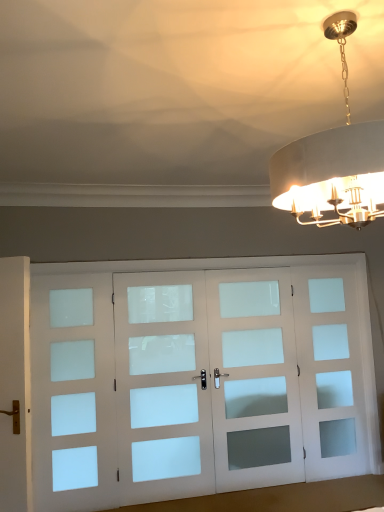
This screenshot has width=384, height=512. What do you see at coordinates (333, 161) in the screenshot? I see `metallic gold chandelier at upper right` at bounding box center [333, 161].

Image resolution: width=384 pixels, height=512 pixels. What do you see at coordinates (254, 379) in the screenshot? I see `white frosted glass screen door at center, the 3th screen door from the left` at bounding box center [254, 379].

The image size is (384, 512). What do you see at coordinates (162, 386) in the screenshot?
I see `white frosted glass door at center, acting as the second screen door starting from the left` at bounding box center [162, 386].

You are a GUI agent. You are given a task and a screenshot of the screen. Output one action in this format:
    pyautogui.click(x=<x>, y=<y>)
    Task: Click on the white frosted glass screen door at right, the 1th screen door in the right-to-left sequence
    The height and width of the screenshot is (512, 384).
    Given the screenshot: What is the action you would take?
    pyautogui.click(x=330, y=371)

From a real-world perspective, is white frosted glass door at center, which is the third screen door from right to left, above or below metallic gold chandelier at upper right?

white frosted glass door at center, which is the third screen door from right to left, is situated lower than metallic gold chandelier at upper right in the real world.

Can you tell me how much white frosted glass door at center, which is the third screen door from right to left, and metallic gold chandelier at upper right differ in facing direction?

They differ by 91.1 degrees in their facing directions.

Is there a large distance between white frosted glass door at center, acting as the second screen door starting from the left, and metallic gold chandelier at upper right?

Yes, white frosted glass door at center, acting as the second screen door starting from the left, is far from metallic gold chandelier at upper right.

From the image's perspective, which one is positioned higher, white frosted glass door at center, acting as the second screen door starting from the left, or metallic gold chandelier at upper right?

metallic gold chandelier at upper right.

Do you think metallic gold chandelier at upper right is within white frosted glass door at center, which is the third screen door from right to left, or outside of it?

metallic gold chandelier at upper right is outside white frosted glass door at center, which is the third screen door from right to left.

Looking at this image, is metallic gold chandelier at upper right bigger or smaller than white frosted glass door at center, acting as the second screen door starting from the left?

In the image, metallic gold chandelier at upper right appears to be larger than white frosted glass door at center, acting as the second screen door starting from the left.

Is metallic gold chandelier at upper right further to the viewer compared to white frosted glass door at center, which is the third screen door from right to left?

No.

How many degrees apart are the facing directions of metallic gold chandelier at upper right and white frosted glass door at center, which is the third screen door from right to left?

metallic gold chandelier at upper right and white frosted glass door at center, which is the third screen door from right to left, are facing 91.1 degrees away from each other.

From a real-world perspective, between white frosted glass screen door at right, the 1th screen door in the right-to-left sequence, and metallic gold chandelier at upper right, who is vertically higher?

In real-world perspective, metallic gold chandelier at upper right is above.

From the image's perspective, which one is positioned lower, white frosted glass screen door at right, the fourth screen door when ordered from left to right, or metallic gold chandelier at upper right?

From the image's view, white frosted glass screen door at right, the fourth screen door when ordered from left to right, is below.

In the scene shown: Considering the relative positions of white frosted glass screen door at right, the fourth screen door when ordered from left to right, and metallic gold chandelier at upper right in the image provided, is white frosted glass screen door at right, the fourth screen door when ordered from left to right, to the left or to the right of metallic gold chandelier at upper right?

Based on their positions, white frosted glass screen door at right, the fourth screen door when ordered from left to right, is located to the right of metallic gold chandelier at upper right.

Is white frosted glass door at center, which is the third screen door from right to left, to the right of white frosted glass screen door at center, arranged as the 2th screen door when viewed from the right, from the viewer's perspective?

Incorrect, white frosted glass door at center, which is the third screen door from right to left, is not on the right side of white frosted glass screen door at center, arranged as the 2th screen door when viewed from the right.

Considering the points (160, 361) and (291, 452), which point is in front, point (160, 361) or point (291, 452)?

The point (160, 361) is closer.

Can you confirm if white frosted glass door at center, acting as the second screen door starting from the left, is thinner than white frosted glass screen door at center, arranged as the 2th screen door when viewed from the right?

A: Incorrect, the width of white frosted glass door at center, acting as the second screen door starting from the left, is not less than that of white frosted glass screen door at center, arranged as the 2th screen door when viewed from the right.

From the image's perspective, which is above, white frosted glass screen door at right, the 1th screen door in the right-to-left sequence, or white frosted glass screen door at center, arranged as the 2th screen door when viewed from the right?

From the image's view, white frosted glass screen door at right, the 1th screen door in the right-to-left sequence, is above.

In the image, is white frosted glass screen door at right, the fourth screen door when ordered from left to right, on the left side or the right side of white frosted glass screen door at center, arranged as the 2th screen door when viewed from the right?

white frosted glass screen door at right, the fourth screen door when ordered from left to right, is positioned on white frosted glass screen door at center, arranged as the 2th screen door when viewed from the right,'s right side.

Image resolution: width=384 pixels, height=512 pixels. In order to click on screen door that is the 3rd one below the white frosted glass screen door at center, the 3th screen door from the left (from a real-world perspective) in this screenshot , I will do `click(330, 371)`.

Does white frosted glass screen door at right, the 1th screen door in the right-to-left sequence, turn towards white frosted glass screen door at center, the 3th screen door from the left?

No.

From a real-world perspective, which object stands above the other?

white frosted glass screen door at left, marked as the 4th screen door in a right-to-left arrangement.

In the scene shown: What's the angular difference between white frosted glass screen door at right, the 1th screen door in the right-to-left sequence, and white frosted glass screen door at left, which is the 1th screen door from left to right,'s facing directions?

0.00488 degrees.

Choose the correct answer: Is white frosted glass screen door at right, the fourth screen door when ordered from left to right, inside white frosted glass screen door at left, marked as the 4th screen door in a right-to-left arrangement, or outside it?

white frosted glass screen door at right, the fourth screen door when ordered from left to right, lies outside white frosted glass screen door at left, marked as the 4th screen door in a right-to-left arrangement.

From the image's perspective, is white frosted glass screen door at right, the fourth screen door when ordered from left to right, above or below white frosted glass screen door at left, marked as the 4th screen door in a right-to-left arrangement?

white frosted glass screen door at right, the fourth screen door when ordered from left to right, is above white frosted glass screen door at left, marked as the 4th screen door in a right-to-left arrangement.

Is metallic gold chandelier at upper right facing away from white frosted glass screen door at right, the fourth screen door when ordered from left to right?

metallic gold chandelier at upper right is not turned away from white frosted glass screen door at right, the fourth screen door when ordered from left to right.

Between metallic gold chandelier at upper right and white frosted glass screen door at right, the 1th screen door in the right-to-left sequence, which one is positioned in front?

metallic gold chandelier at upper right is closer to the camera.

Based on their positions, is metallic gold chandelier at upper right located to the left or right of white frosted glass screen door at right, the fourth screen door when ordered from left to right?

metallic gold chandelier at upper right is positioned on white frosted glass screen door at right, the fourth screen door when ordered from left to right,'s left side.

What's the angular difference between metallic gold chandelier at upper right and white frosted glass screen door at right, the fourth screen door when ordered from left to right,'s facing directions?

91.1 degrees.

You are a GUI agent. You are given a task and a screenshot of the screen. Output one action in this format:
    pyautogui.click(x=<x>, y=<y>)
    Task: Click on the screen door that is the 1st one when counting leftward from the metallic gold chandelier at upper right
    
    Given the screenshot: What is the action you would take?
    pyautogui.click(x=162, y=386)

What are the coordinates of `screen door that is the 3rd object located below the metallic gold chandelier at upper right (from the image's perspective)` in the screenshot? It's located at (162, 386).

Based on their spatial positions, is white frosted glass screen door at center, arranged as the 2th screen door when viewed from the right, or white frosted glass screen door at left, which is the 1th screen door from left to right, closer to white frosted glass screen door at right, the 1th screen door in the right-to-left sequence?

The object closer to white frosted glass screen door at right, the 1th screen door in the right-to-left sequence, is white frosted glass screen door at center, arranged as the 2th screen door when viewed from the right.

From the image, which object appears to be farther from white frosted glass screen door at left, marked as the 4th screen door in a right-to-left arrangement, white frosted glass screen door at center, the 3th screen door from the left, or white frosted glass door at center, acting as the second screen door starting from the left?

The object further to white frosted glass screen door at left, marked as the 4th screen door in a right-to-left arrangement, is white frosted glass screen door at center, the 3th screen door from the left.

When comparing their distances from white frosted glass screen door at center, arranged as the 2th screen door when viewed from the right, does metallic gold chandelier at upper right or white frosted glass door at center, acting as the second screen door starting from the left, seem further?

Among the two, metallic gold chandelier at upper right is located further to white frosted glass screen door at center, arranged as the 2th screen door when viewed from the right.

Based on their spatial positions, is white frosted glass screen door at right, the fourth screen door when ordered from left to right, or white frosted glass door at center, which is the third screen door from right to left, further from white frosted glass screen door at left, which is the 1th screen door from left to right?

white frosted glass screen door at right, the fourth screen door when ordered from left to right, lies further to white frosted glass screen door at left, which is the 1th screen door from left to right, than the other object.

When comparing their distances from white frosted glass screen door at center, the 3th screen door from the left, does white frosted glass screen door at left, which is the 1th screen door from left to right, or metallic gold chandelier at upper right seem further?

metallic gold chandelier at upper right.

Looking at the image, which one is located closer to white frosted glass screen door at center, the 3th screen door from the left, white frosted glass door at center, which is the third screen door from right to left, or white frosted glass screen door at right, the 1th screen door in the right-to-left sequence?

Based on the image, white frosted glass screen door at right, the 1th screen door in the right-to-left sequence, appears to be nearer to white frosted glass screen door at center, the 3th screen door from the left.

Based on their spatial positions, is white frosted glass door at center, acting as the second screen door starting from the left, or metallic gold chandelier at upper right closer to white frosted glass screen door at center, the 3th screen door from the left?

white frosted glass door at center, acting as the second screen door starting from the left.

Considering their positions, is white frosted glass screen door at left, which is the 1th screen door from left to right, positioned further to white frosted glass screen door at center, the 3th screen door from the left, than white frosted glass door at center, acting as the second screen door starting from the left?

Based on the image, white frosted glass screen door at left, which is the 1th screen door from left to right, appears to be further to white frosted glass screen door at center, the 3th screen door from the left.

Identify the location of screen door between white frosted glass door at center, acting as the second screen door starting from the left, and white frosted glass screen door at right, the 1th screen door in the right-to-left sequence, from left to right. The height and width of the screenshot is (512, 384). (254, 379).

I want to click on screen door between metallic gold chandelier at upper right and white frosted glass door at center, acting as the second screen door starting from the left, from front to back, so click(x=73, y=393).

Locate an element on the screen. screen door between white frosted glass screen door at left, which is the 1th screen door from left to right, and white frosted glass screen door at center, arranged as the 2th screen door when viewed from the right, in the horizontal direction is located at coordinates (162, 386).